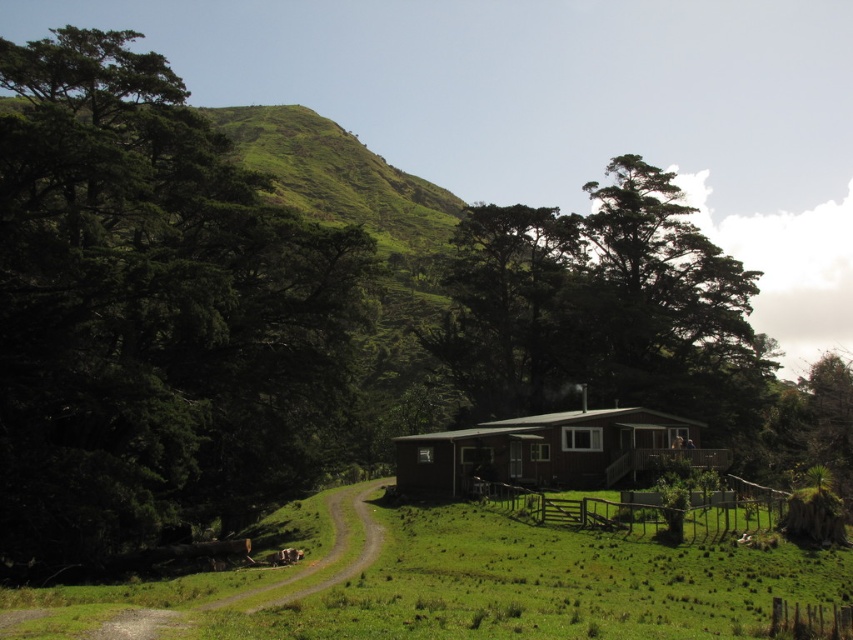
Question: Does green leafy tree at left appear under green grassy field at center?

Choices:
 (A) yes
 (B) no

Answer: (B)

Question: Can you confirm if green grassy field at center is positioned below green leafy tree at center?

Choices:
 (A) no
 (B) yes

Answer: (B)

Question: Can you confirm if green grassy field at center is positioned above green leafy tree at center?

Choices:
 (A) yes
 (B) no

Answer: (B)

Question: Which point is farther to the camera?

Choices:
 (A) green leafy tree at left
 (B) green leafy tree at center
 (C) brown wooden hut at center

Answer: (B)

Question: Among these objects, which one is farthest from the camera?

Choices:
 (A) green leafy tree at center
 (B) green grassy field at center
 (C) green leafy tree at left
 (D) brown fur dog at lower center

Answer: (A)

Question: Based on their relative distances, which object is farther from the green leafy tree at center?

Choices:
 (A) brown wooden hut at center
 (B) brown fur dog at lower center
 (C) green leafy tree at left
 (D) green grassy field at center

Answer: (B)